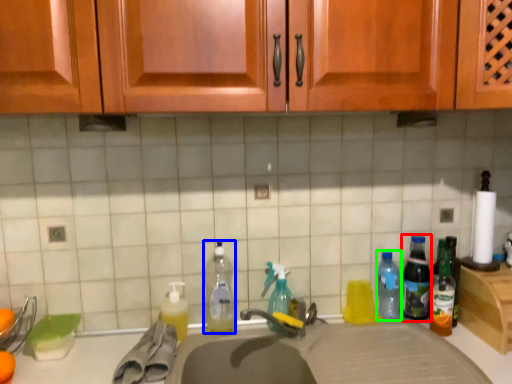
Question: Estimate the real-world distances between objects in this image. Which object is farther from bottle (highlighted by a red box), bottle (highlighted by a blue box) or bottle (highlighted by a green box)?

Choices:
 (A) bottle
 (B) bottle

Answer: (A)